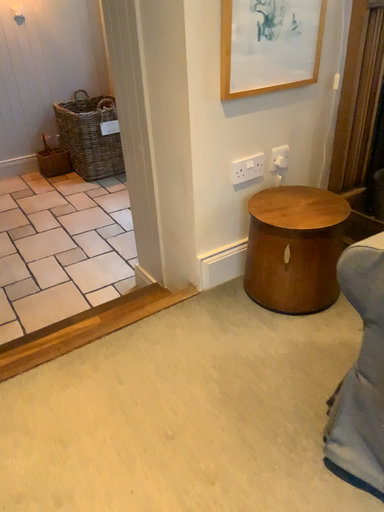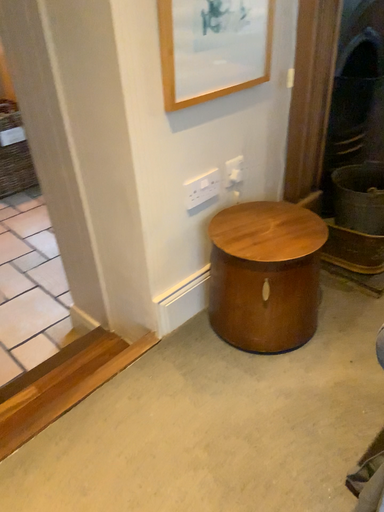
Question: Which way did the camera rotate in the video?

Choices:
 (A) rotated left
 (B) rotated right

Answer: (B)